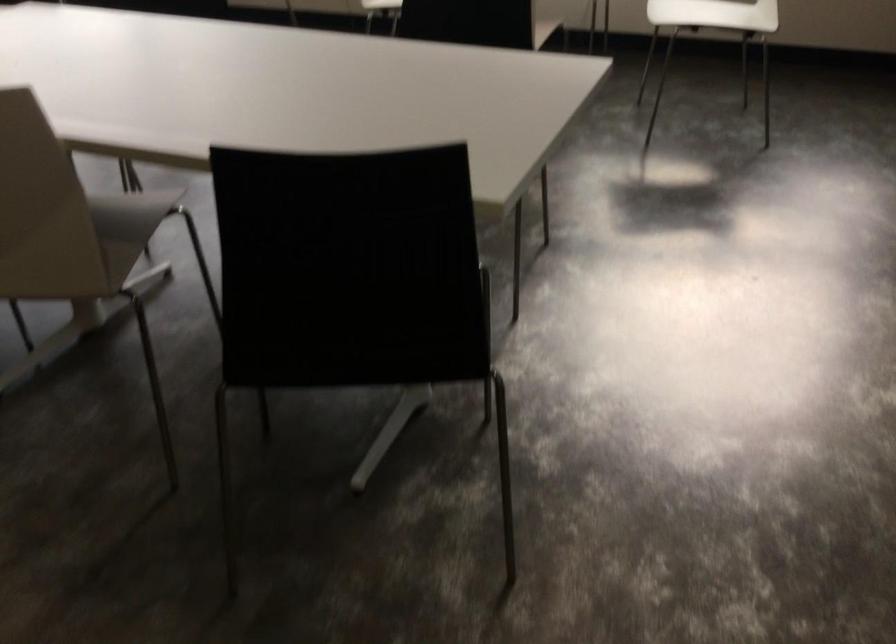
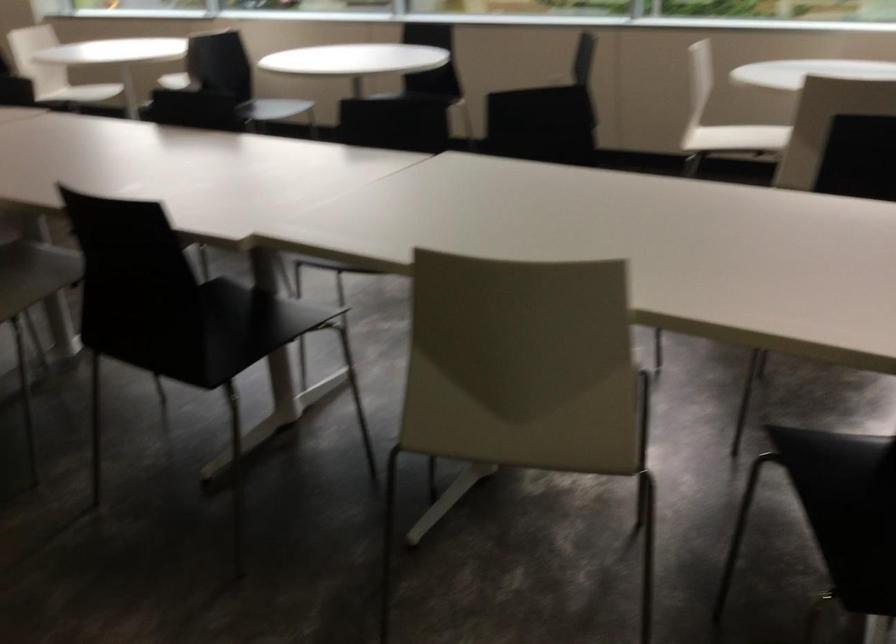
Question: Which direction would the cameraman need to move to produce the second image? Reply with the corresponding letter.

Choices:
 (A) Left
 (B) Right
 (C) Forward
 (D) Backward

Answer: (A)